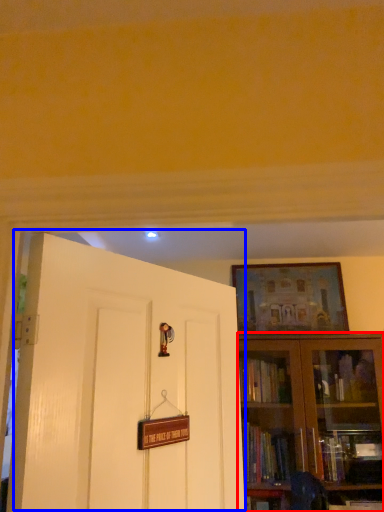
Question: Which of the following is the farthest to the observer, bookcase (highlighted by a red box) or door (highlighted by a blue box)?

Choices:
 (A) bookcase
 (B) door

Answer: (A)